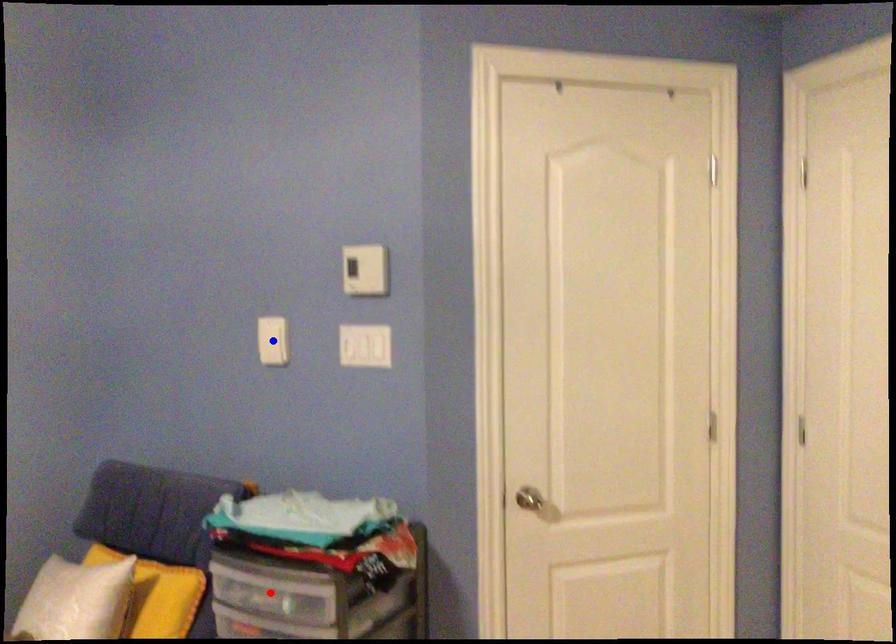
Question: Two points are marked on the image. Which point is closer to the camera?

Choices:
 (A) Blue point is closer.
 (B) Red point is closer.

Answer: (B)